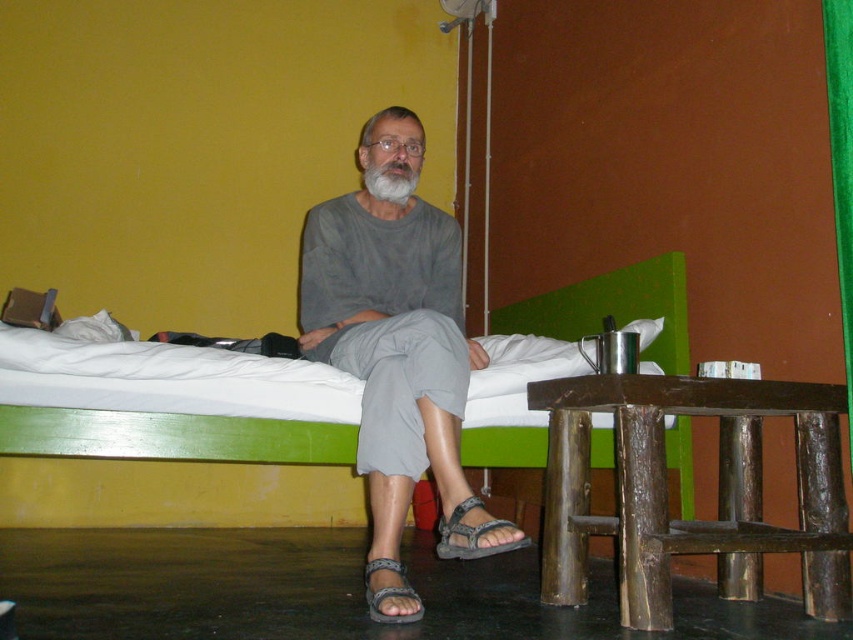
Can you confirm if brown wooden stool at lower right is positioned to the left of brown woven sandal at lower center?

No, brown wooden stool at lower right is not to the left of brown woven sandal at lower center.

Looking at this image, can you confirm if brown wooden stool at lower right is thinner than brown woven sandal at lower center?

No, brown wooden stool at lower right is not thinner than brown woven sandal at lower center.

Identify the location of brown wooden stool at lower right. (666, 490).

Which is more to the right, gray cotton shirt at center or brown wooden stool at lower right?

brown wooden stool at lower right

Is gray cotton shirt at center closer to the viewer compared to brown wooden stool at lower right?

That is True.

Locate an element on the screen. This screenshot has height=640, width=853. gray cotton shirt at center is located at coordinates (398, 356).

Can you confirm if brown wooden stool at lower right is positioned below green velvet curtain at right?

Indeed, brown wooden stool at lower right is positioned under green velvet curtain at right.

Is brown wooden stool at lower right further to the viewer compared to green velvet curtain at right?

No.

Is point (775, 403) farther from camera compared to point (822, 26)?

No.

Identify the location of brown wooden stool at lower right. The image size is (853, 640). (666, 490).